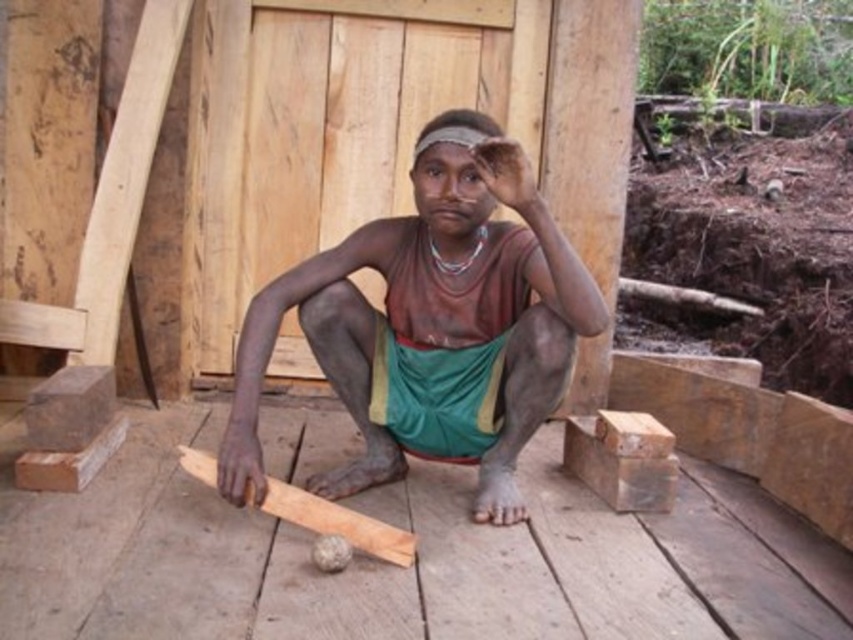
You are a carpenter working on a construction site. You need to place a new wooden beam on the platform. The beam is exactly the same size as the brown wood plank at lower center. Can you place it directly on top of the brown matte wood at center without overlapping the edges?

The brown matte wood at center is positioned over brown wood plank at lower center, meaning it already covers part of the plank. Since the beam is the same size as the plank, placing it on top of the matte wood would cause overlap beyond the plank, making it unstable. Therefore, you cannot place the beam directly on top without overlapping the edges.